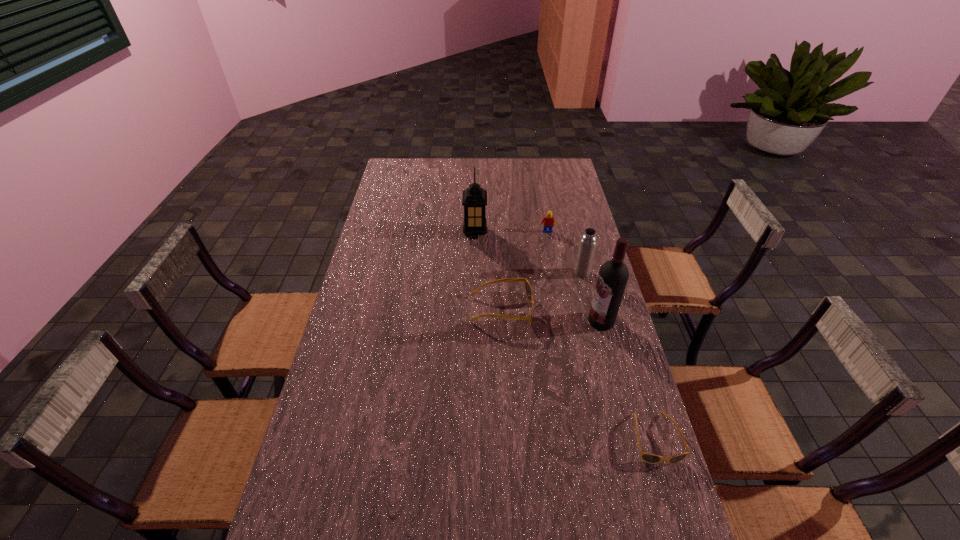
All sunglassess are currently evenly spaced. To continue this pattern, where would you add another sunglasses on the left? Please point out a vacant spot. Please provide its 2D coordinates. Your answer should be formatted as a tuple, i.e. [(x, y)], where the tuple contains the x and y coordinates of a point satisfying the conditions above.

[(403, 228)]